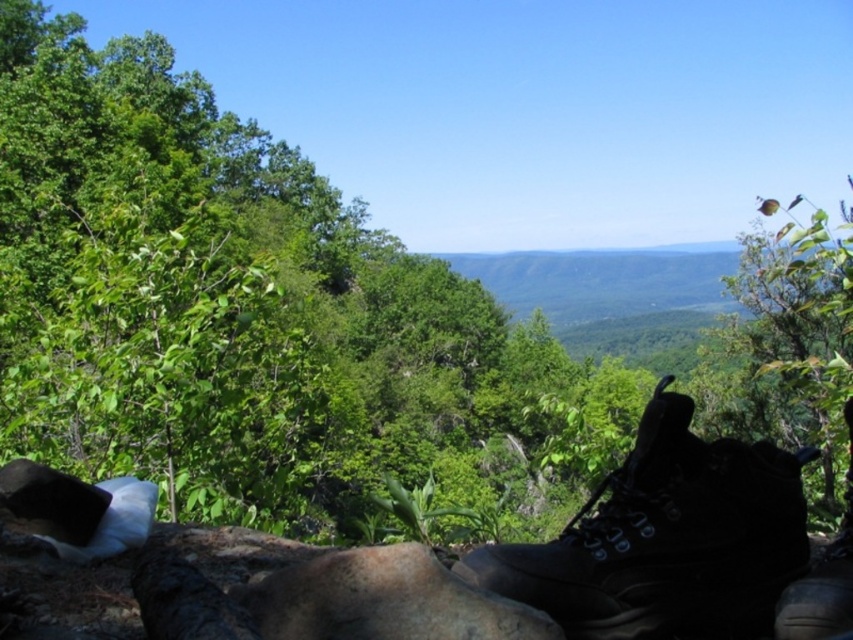
Question: Can you confirm if matte black boot at lower right is smaller than black leather boot at lower right?

Choices:
 (A) yes
 (B) no

Answer: (A)

Question: Can you confirm if matte black boot at lower right is smaller than black leather boot at lower right?

Choices:
 (A) no
 (B) yes

Answer: (B)

Question: Which object appears farthest from the camera in this image?

Choices:
 (A) matte black boot at lower right
 (B) black leather boot at lower right

Answer: (A)

Question: Is matte black boot at lower right below black leather boot at lower right?

Choices:
 (A) yes
 (B) no

Answer: (B)